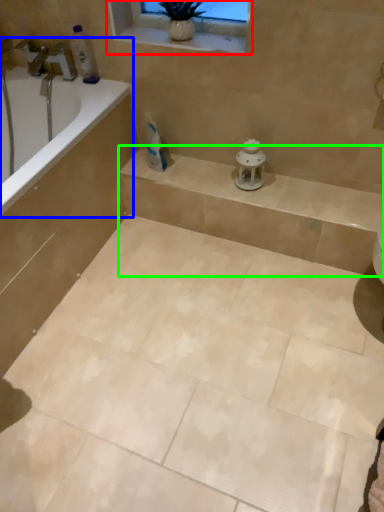
Question: Based on their relative distances, which object is farther from window frame (highlighted by a red box)? Choose from bathtub (highlighted by a blue box) and balustrade (highlighted by a green box).

Choices:
 (A) bathtub
 (B) balustrade

Answer: (B)